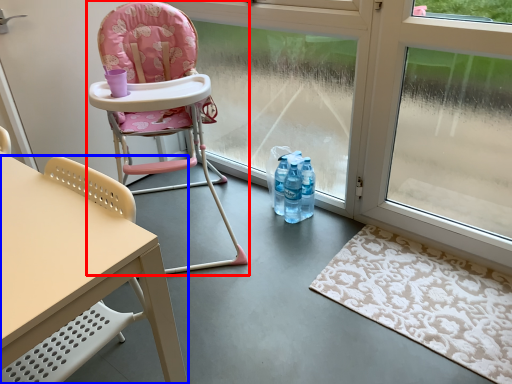
Question: Among these objects, which one is nearest to the camera, chair (highlighted by a red box) or chair (highlighted by a blue box)?

Choices:
 (A) chair
 (B) chair

Answer: (B)